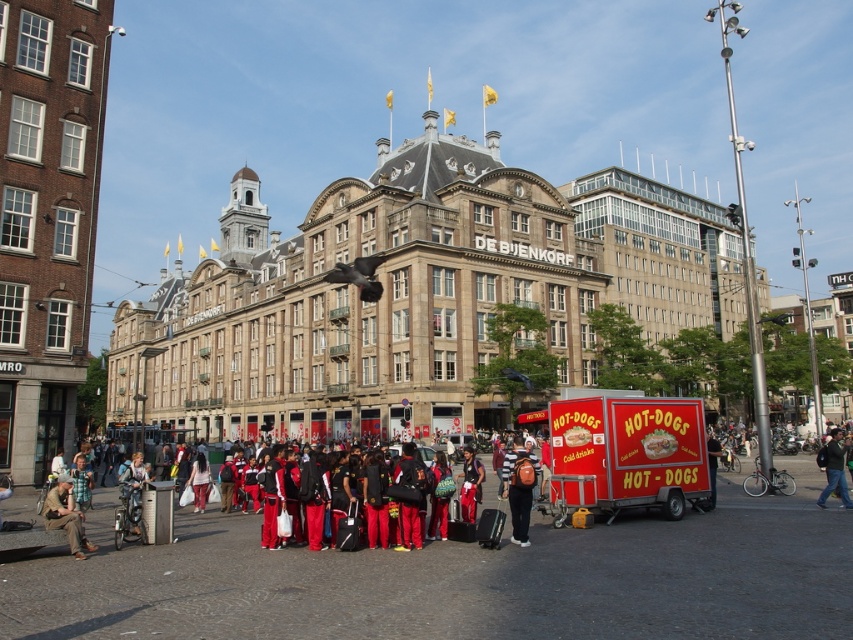
Question: Where is dark green jacket at center located in relation to red fabric pants at lower center in the image?

Choices:
 (A) below
 (B) above

Answer: (B)

Question: Which point is closer to the camera?

Choices:
 (A) tap(461, 499)
 (B) tap(82, 556)
 (C) tap(840, 461)
 (D) tap(419, 472)

Answer: (B)

Question: Does red painted trailer at lower right appear over dark green jacket at center?

Choices:
 (A) yes
 (B) no

Answer: (A)

Question: Can you confirm if matte black backpack at center is bigger than brown leather backpack at lower center?

Choices:
 (A) yes
 (B) no

Answer: (B)

Question: Which of these objects is positioned farthest from the leather jacket at lower left?

Choices:
 (A) dark green jacket at center
 (B) brown leather backpack at lower center

Answer: (A)

Question: Considering the real-world distances, which object is closest to the red painted trailer at lower right?

Choices:
 (A) red fabric pants at lower center
 (B) leather jacket at lower left

Answer: (A)